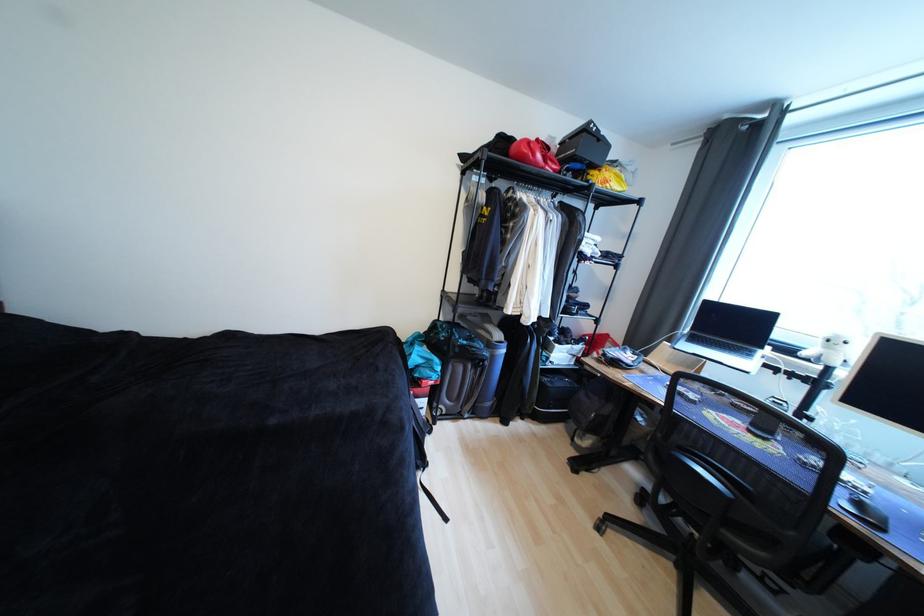
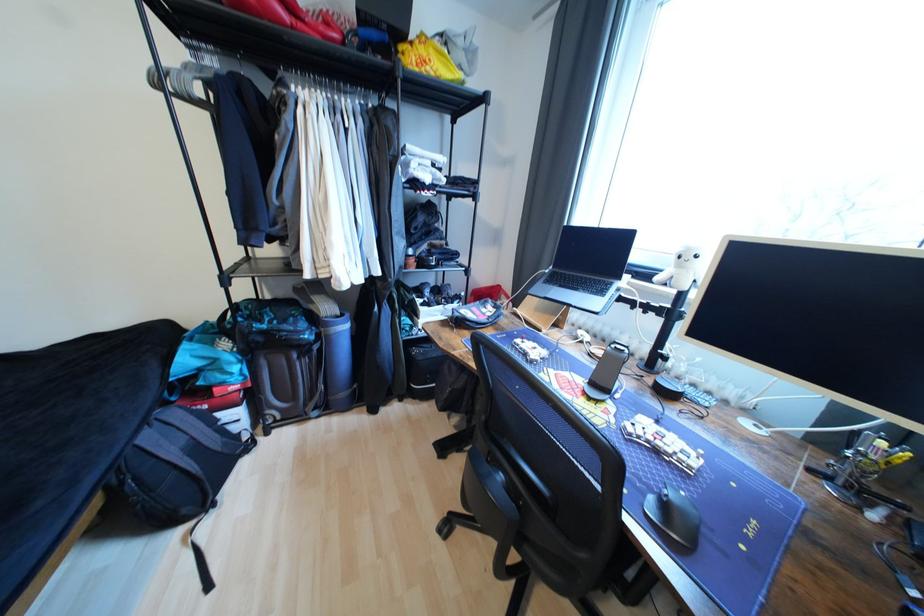
The images are taken continuously from a first-person perspective. In which direction are you moving?

The cameraman moved toward right, forward.